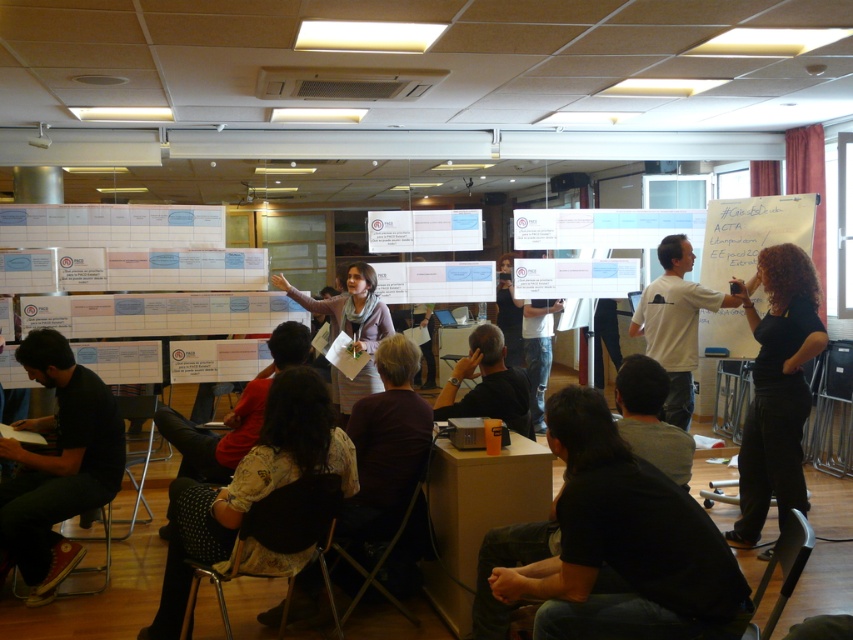
You are organizing a presentation and need to place a new poster on the wall. The poster is the same size as the matte gray sweater at center. Can the white paperboard at upper right accommodate this poster without overlapping?

The white paperboard at upper right occupies less space than the matte gray sweater at center. Since the poster is the same size as the matte gray sweater at center, the white paperboard at upper right is not large enough to accommodate it without overlapping.

You are a participant in the workshop and need to refer to the white paperboard at upper right while also keeping an eye on the matte gray sweater at center. Which object is closer to you?

The white paperboard at upper right is closer to you than the matte gray sweater at center because it is further to the viewer.